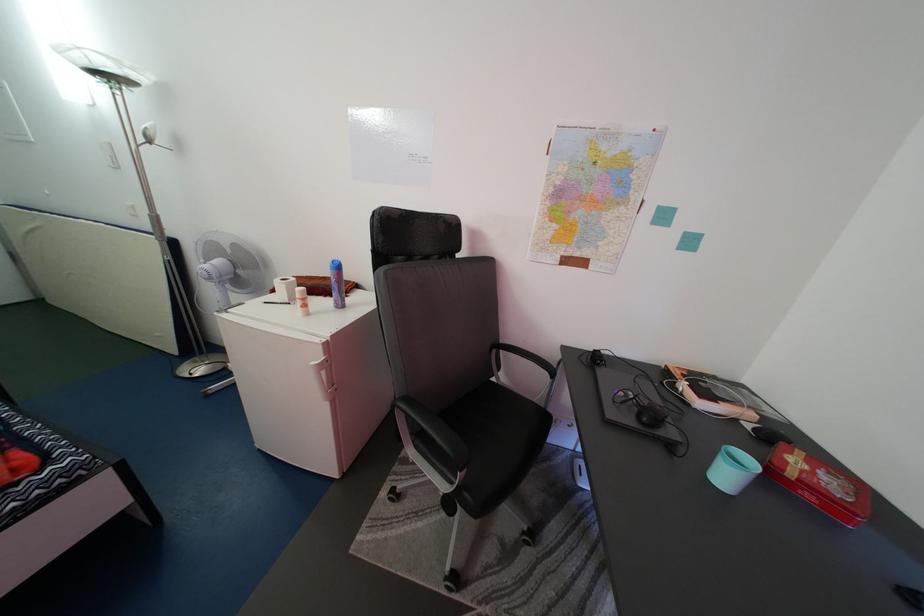
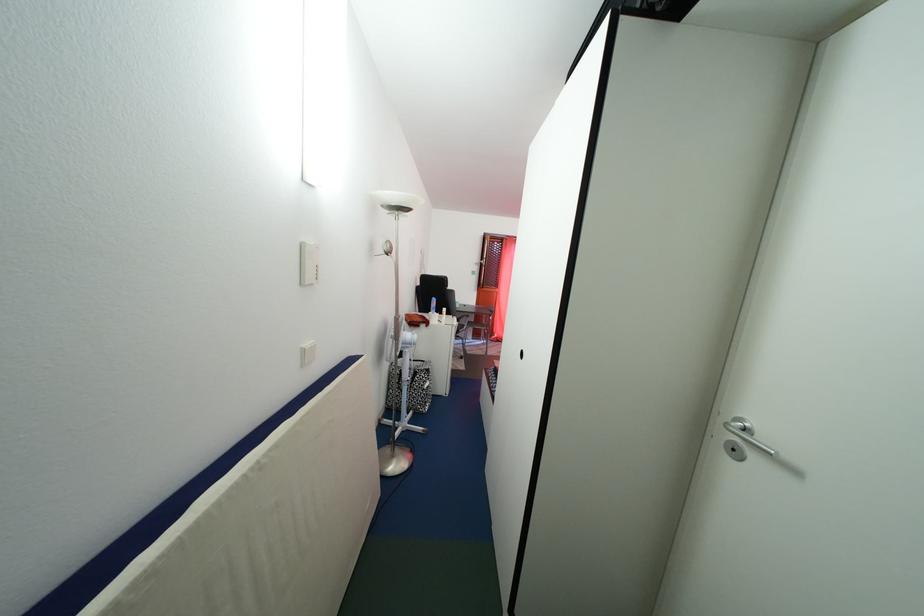
Find the pixel in the second image that matches pixel 735 484 in the first image.

(466, 313)